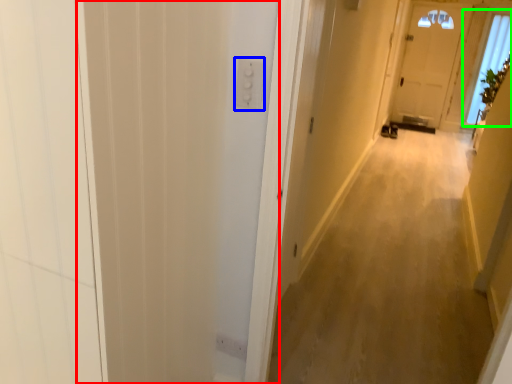
Question: Based on their relative distances, which object is farther from screen door (highlighted by a red box)? Choose from electric outlet (highlighted by a blue box) and window (highlighted by a green box).

Choices:
 (A) electric outlet
 (B) window

Answer: (B)